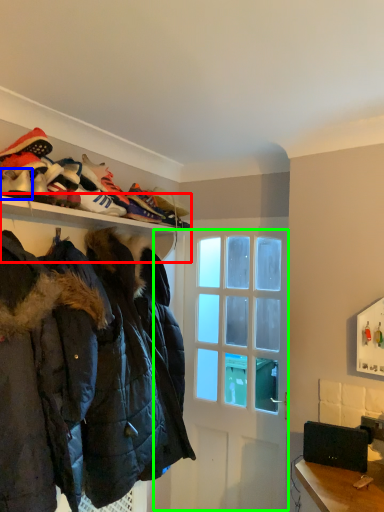
Question: Which object is the farthest from shelf (highlighted by a red box)? Choose among these: footwear (highlighted by a blue box) or glass door (highlighted by a green box).

Choices:
 (A) footwear
 (B) glass door

Answer: (B)